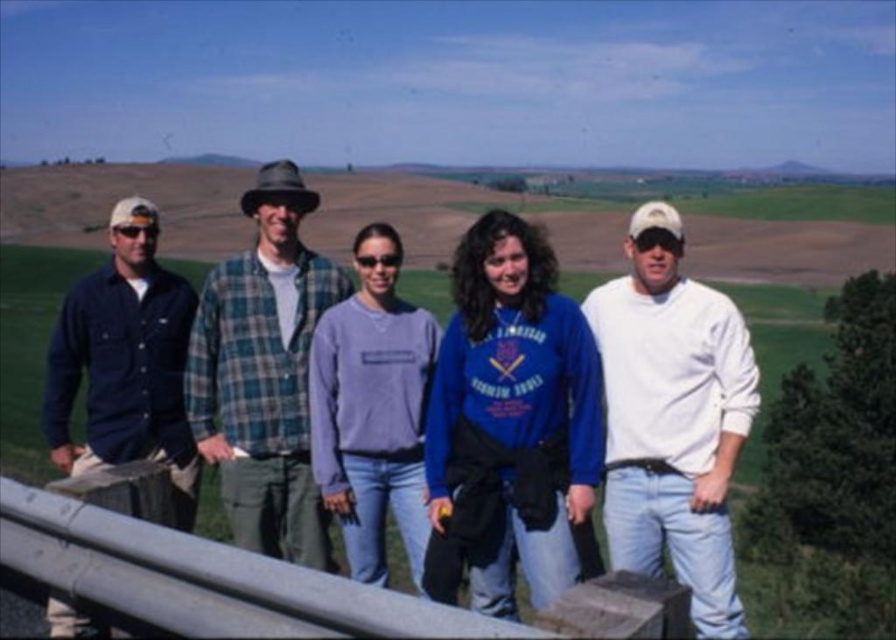
You are standing in the group of five people in the image. You want to move from the position of point 1 at point (192, 342) to point 2 at (392, 230). Which direction should you walk to get closer to point 2?

To move from point 1 at (192, 342) to point 2 at (392, 230), you should walk towards the background since point 1 is closer to the viewer than point 2.

You are a photographer setting up a shot of the group. The white cotton shirt at center and the metallic gray rail at center are both in your frame. Which object should you focus on first if you want to capture the larger one?

The white cotton shirt at center has a larger size compared to the metallic gray rail at center, so you should focus on the white cotton shirt at center first.